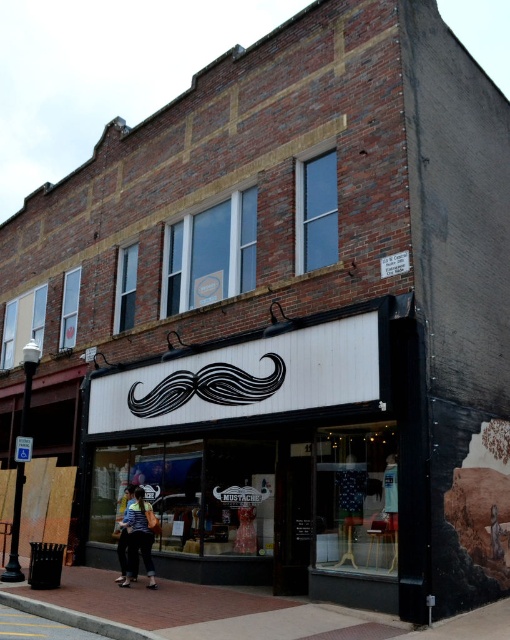
You are a customer standing in front of the brick building. You see the brick pavement at lower center and the striped shirt at center. Which object appears larger in the image?

The striped shirt at center appears larger than the brick pavement at lower center.

You are a customer looking at the storefront window of MUSTACHE. You see a striped shirt at center and a denim jacket at lower left. Which clothing item is more to the left?

The denim jacket at lower left is more to the left than the striped shirt at center.

You are standing at point (139, 525) and want to reach the entrance of the MUSTACHE shop. The shop entrance is located at the lower level. The distance between you and the entrance is 37.11 feet. If you walk at a speed of 3 feet per second, how many seconds will it take you to reach the entrance?

The distance between you and the entrance is 37.11 feet. Walking at 3 feet per second, it will take 37.11 divided by 3, which is approximately 12.37 seconds to reach the entrance.